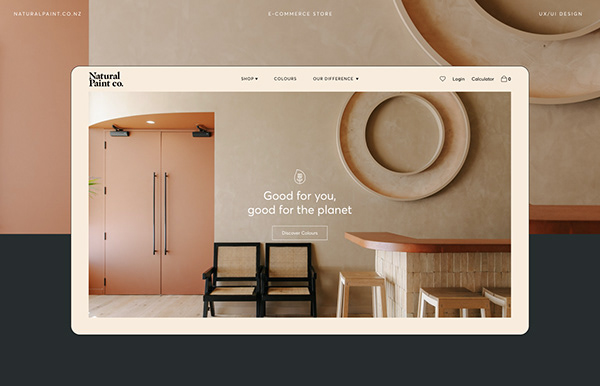
Where is `wall`? wall is located at coordinates (295, 119).